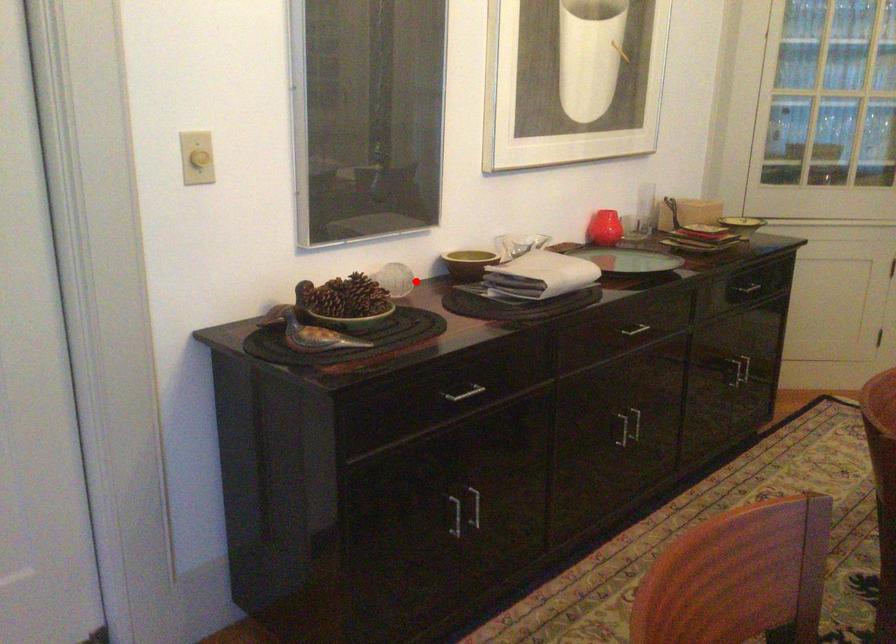
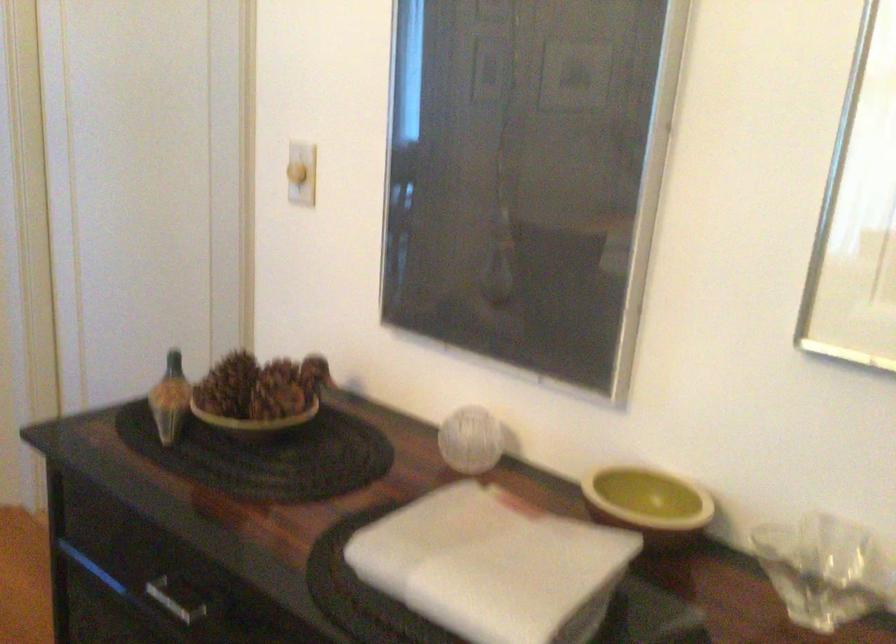
Question: I am providing you with two images of the same scene from different viewpoints. Image1 has a red point marked. In image2, the corresponding 3D location appears at what relative position? Reply with the corresponding letter.

Choices:
 (A) Closer
 (B) Farther

Answer: (A)